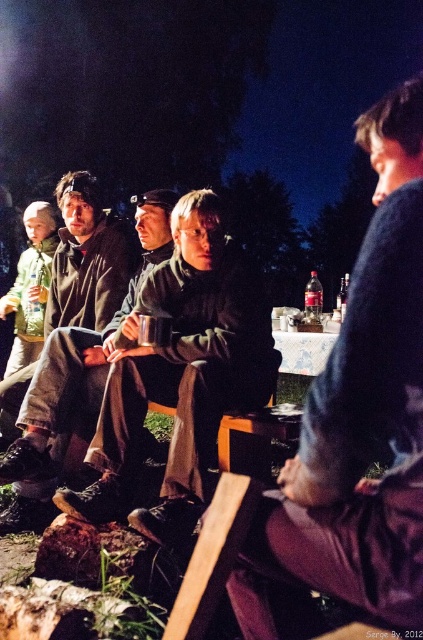
Does dark blue sweater at upper right have a smaller size compared to dark green fabric jacket at center?

Correct, dark blue sweater at upper right occupies less space than dark green fabric jacket at center.

Between point (406, 282) and point (203, 476), which one is positioned behind?

Point (203, 476)

Locate an element on the screen. dark blue sweater at upper right is located at coordinates pos(359,416).

Who is more distant from viewer, (378, 163) or (36, 516)?

The point (36, 516) is more distant.

From the picture: Is dark blue sweater at upper right wider than dark brown leather jacket at center?

In fact, dark blue sweater at upper right might be narrower than dark brown leather jacket at center.

Describe the element at coordinates (359, 416) in the screenshot. I see `dark blue sweater at upper right` at that location.

Image resolution: width=423 pixels, height=640 pixels. In order to click on dark blue sweater at upper right in this screenshot , I will do `click(359, 416)`.

Does dark green fabric jacket at center lie behind dark brown leather jacket at center?

No, dark green fabric jacket at center is closer to the viewer.

Which is behind, point (220, 298) or point (30, 444)?

The point (220, 298) is behind.

Locate an element on the screen. dark green fabric jacket at center is located at coordinates (183, 372).